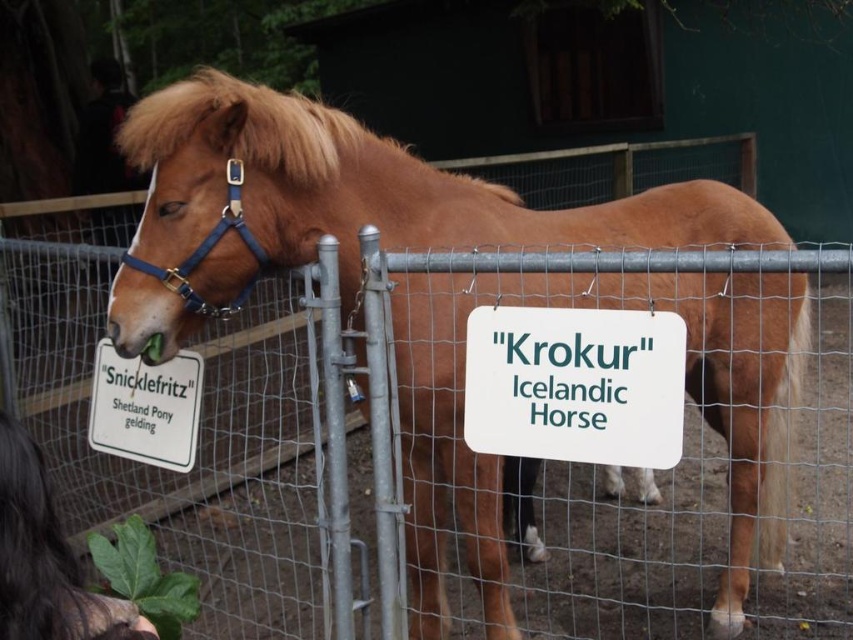
Question: Can you confirm if brown glossy icelandic horse at center is bigger than white plastic sign at center?

Choices:
 (A) no
 (B) yes

Answer: (B)

Question: In this image, where is brown glossy icelandic horse at center located relative to white plastic sign at left?

Choices:
 (A) left
 (B) right

Answer: (B)

Question: Which of the following is the closest to the observer?

Choices:
 (A) white plastic sign at left
 (B) white plastic sign at center
 (C) brown glossy icelandic horse at center

Answer: (B)

Question: Is brown glossy icelandic horse at center below white plastic sign at left?

Choices:
 (A) yes
 (B) no

Answer: (A)

Question: Which point is farther from the camera taking this photo?

Choices:
 (A) (93, 433)
 (B) (196, 76)
 (C) (531, 410)

Answer: (B)

Question: Among these objects, which one is nearest to the camera?

Choices:
 (A) white plastic sign at left
 (B) white plastic sign at center
 (C) brown glossy icelandic horse at center

Answer: (B)